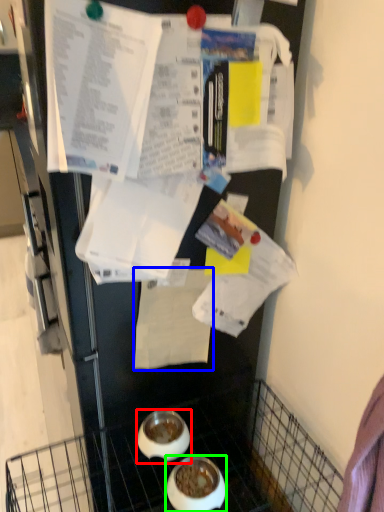
Question: Considering the real-world distances, which object is closest to bowl (highlighted by a red box)? paper (highlighted by a blue box) or bowl (highlighted by a green box).

Choices:
 (A) paper
 (B) bowl

Answer: (B)